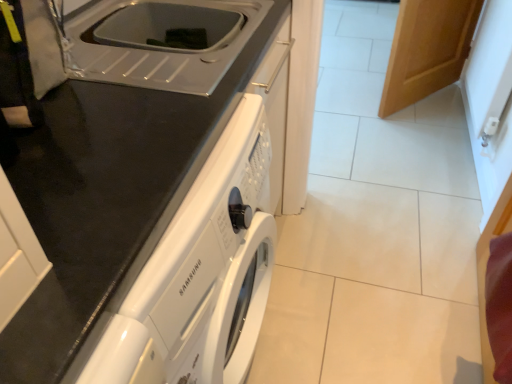
Question: Is white glossy washing machine at center surrounded by wooden door at upper right?

Choices:
 (A) yes
 (B) no

Answer: (B)

Question: Is wooden door at upper right far away from white glossy washing machine at center?

Choices:
 (A) yes
 (B) no

Answer: (A)

Question: Is wooden door at upper right beside white glossy washing machine at center?

Choices:
 (A) yes
 (B) no

Answer: (B)

Question: From a real-world perspective, is wooden door at upper right physically above white glossy washing machine at center?

Choices:
 (A) yes
 (B) no

Answer: (B)

Question: Does wooden door at upper right come behind white glossy washing machine at center?

Choices:
 (A) no
 (B) yes

Answer: (B)

Question: From a real-world perspective, is wooden door at upper right below white glossy washing machine at center?

Choices:
 (A) yes
 (B) no

Answer: (A)

Question: Can you confirm if white glossy washing machine at center is positioned to the left of white plastic sink at upper center?

Choices:
 (A) yes
 (B) no

Answer: (A)

Question: From a real-world perspective, is white glossy washing machine at center on white plastic sink at upper center?

Choices:
 (A) yes
 (B) no

Answer: (B)

Question: Is white glossy washing machine at center oriented away from white plastic sink at upper center?

Choices:
 (A) yes
 (B) no

Answer: (B)

Question: Does white glossy washing machine at center have a greater height compared to white plastic sink at upper center?

Choices:
 (A) no
 (B) yes

Answer: (B)

Question: Is white glossy washing machine at center positioned before white plastic sink at upper center?

Choices:
 (A) no
 (B) yes

Answer: (B)

Question: Are white glossy washing machine at center and white plastic sink at upper center beside each other?

Choices:
 (A) no
 (B) yes

Answer: (A)

Question: From the image's perspective, is white glossy washing machine at center on wooden door at upper right?

Choices:
 (A) no
 (B) yes

Answer: (A)